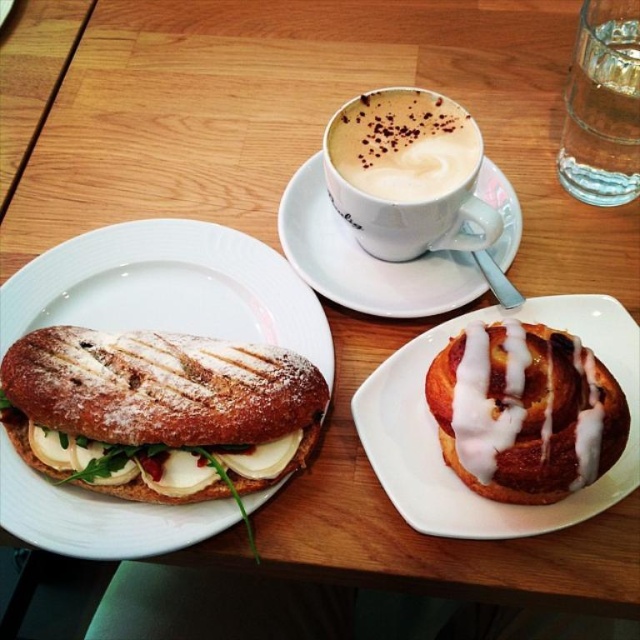
You are a barista who needs to serve a customer. You see the clear glass water at upper right and the white frothy coffee at upper center. Which beverage should you avoid spilling when pouring a hot drink?

The white frothy coffee at upper center should be avoided when pouring a hot drink because the clear glass water at upper right is positioned over it, meaning the coffee is below and could be at risk of being splashed by the water above.

You are a barista trying to place a cup of coffee on the table without spilling it. The cup needs to be placed on the white ceramic saucer at upper center. Given the coordinates provided, can you confirm if the saucer is positioned in a stable location on the table?

The white ceramic saucer at upper center is located at point [365,259], which should be a stable position on the table for placing the coffee cup without spilling.